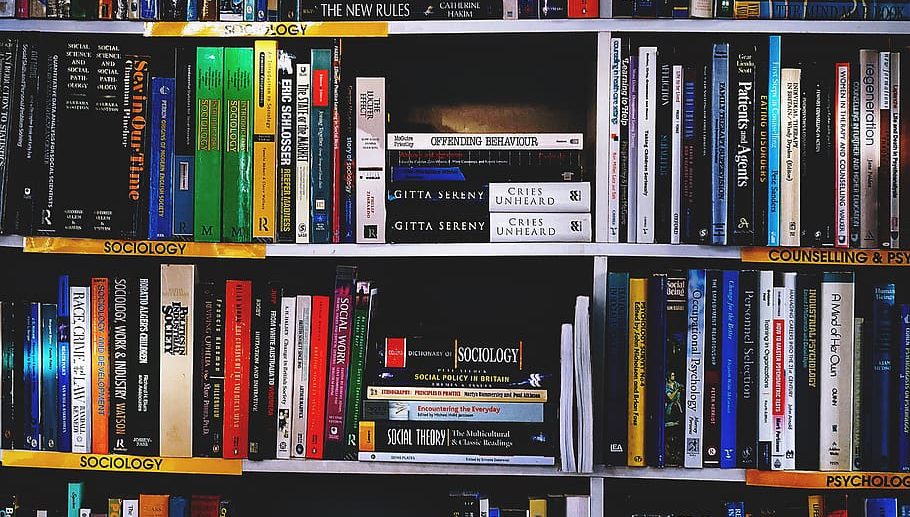
Find the location of a particular element. school books is located at coordinates (782, 408).